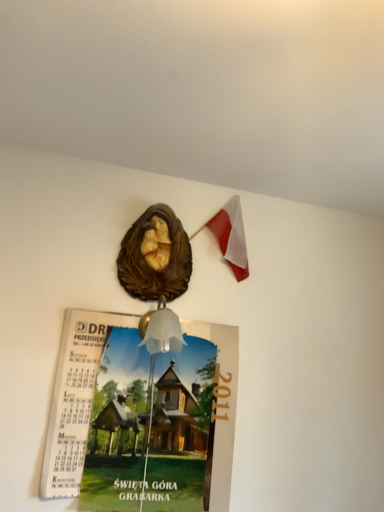
Question: Is matte paper calendar at upper center in front of or behind translucent glass bell at center in the image?

Choices:
 (A) behind
 (B) front

Answer: (A)

Question: In the image, is matte paper calendar at upper center on the left side or the right side of translucent glass bell at center?

Choices:
 (A) left
 (B) right

Answer: (A)

Question: Which object is positioned farthest from the translucent glass bell at center?

Choices:
 (A) white fabric flag at upper right
 (B) matte paper calendar at upper center

Answer: (A)

Question: Which object is positioned closest to the translucent glass bell at center?

Choices:
 (A) matte paper calendar at upper center
 (B) white fabric flag at upper right

Answer: (A)